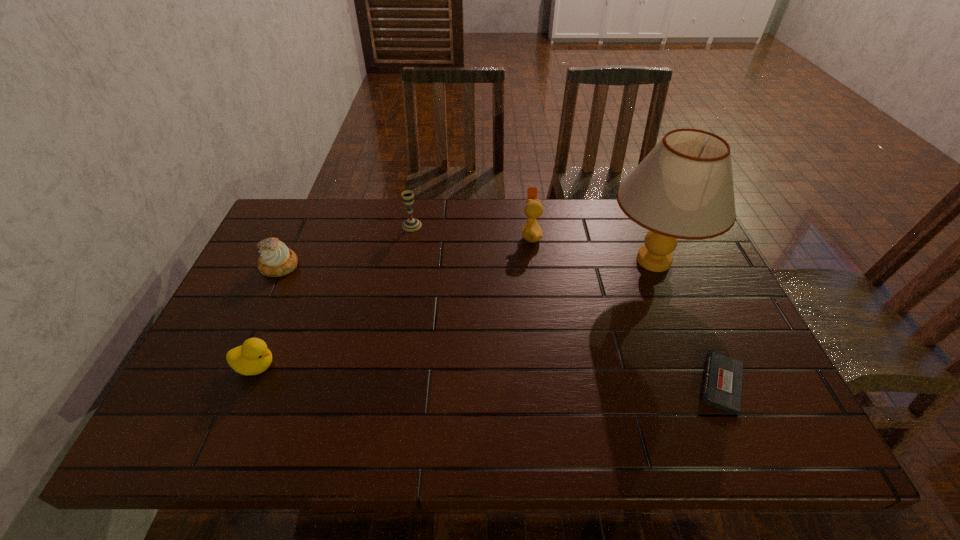
I want to click on lampshade, so [x=683, y=189].

At what (x,y) coordinates should I click in order to perform the action: click on the fourth object from left to right. Please return your answer as a coordinate pair (x, y). Looking at the image, I should click on 531,232.

Image resolution: width=960 pixels, height=540 pixels. What are the coordinates of `the taller duck` in the screenshot? It's located at (531, 232).

Find the location of a particular element. the fourth object from right to left is located at coordinates (411, 224).

This screenshot has height=540, width=960. I want to click on pastry, so click(276, 260).

Where is `the shorter duck`? The image size is (960, 540). the shorter duck is located at coordinates (253, 357).

Locate an element on the screen. the left duck is located at coordinates (253, 357).

Where is `the shortest object`? This screenshot has width=960, height=540. the shortest object is located at coordinates (722, 384).

At what (x,y) coordinates should I click in order to perform the action: click on free location located 0.190m on the left of the tallest object. Please return your answer as a coordinate pair (x, y). Looking at the image, I should click on (538, 261).

What are the coordinates of `free space located 0.130m on the beak of the farther duck` in the screenshot? It's located at (479, 235).